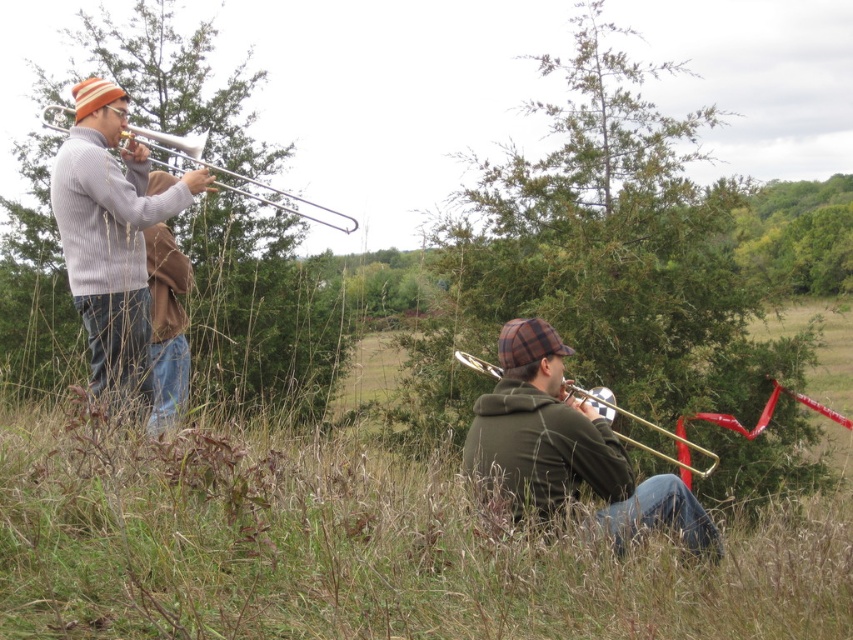
Question: In this image, where is matte silver trombone at left located relative to shiny brass trumpet at lower right?

Choices:
 (A) above
 (B) below

Answer: (A)

Question: Which of the following is the closest to the observer?

Choices:
 (A) matte silver trombone at left
 (B) knit wool sweater at left
 (C) shiny brass trumpet at lower right

Answer: (B)

Question: Which point is farther from the camera taking this photo?

Choices:
 (A) (132, 291)
 (B) (163, 163)

Answer: (B)

Question: Can you confirm if knit wool sweater at left is wider than matte silver trombone at left?

Choices:
 (A) no
 (B) yes

Answer: (A)

Question: Is matte silver trombone at left further to the viewer compared to shiny brass trumpet at lower right?

Choices:
 (A) no
 (B) yes

Answer: (B)

Question: Considering the real-world distances, which object is farthest from the shiny brass trumpet at lower right?

Choices:
 (A) knit wool sweater at left
 (B) matte silver trombone at left

Answer: (B)